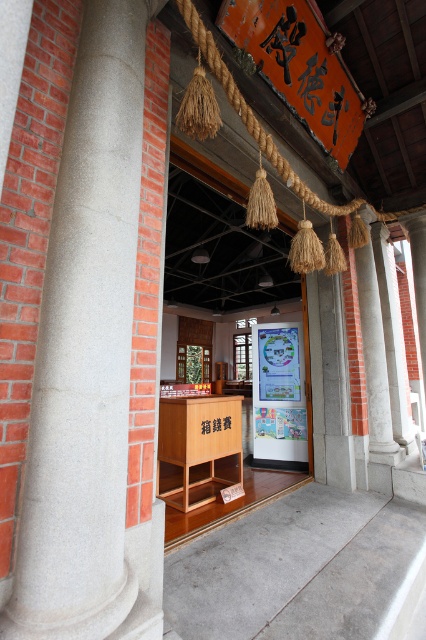
You are a delivery person holding a package that is 6 feet long. You need to pass through the entrance of the building. Can you fit through the space between the orange paper sign at upper center and the white marble column at center without tilting the package?

The orange paper sign at upper center and the white marble column at center are 6.17 feet apart from each other. Since the package is 6 feet long, it can fit through the space as there is enough clearance between them.

You are a visitor approaching the entrance of this traditional building. You notice an orange paper sign at upper center and a wooden box at center. Which object is wider?

The orange paper sign at upper center is wider than the wooden box at center.

You are standing at the entrance of the traditional building and want to take a photo. There are two points marked in the scene. The first point is at coordinates point (239, 32), and the second point is at point (181, 454). Which point will appear larger in your photo?

Point (239, 32) is closer to the camera than point (181, 454), so it will appear larger in the photo.